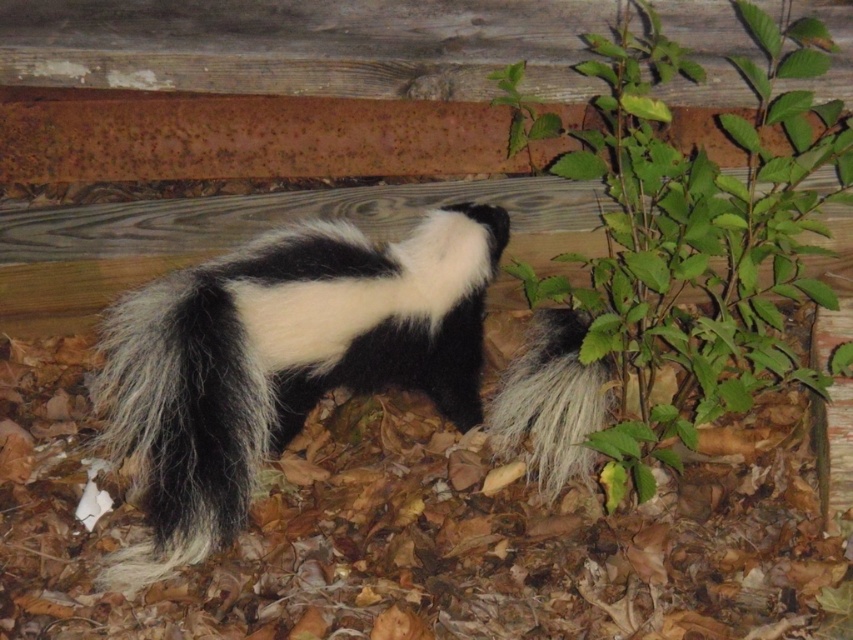
Is black and white fur skunk at center thinner than green leafy plant at center right?

No.

Is black and white fur skunk at center further to the viewer compared to green leafy plant at center right?

No, it is in front of green leafy plant at center right.

The image size is (853, 640). Identify the location of black and white fur skunk at center. (281, 360).